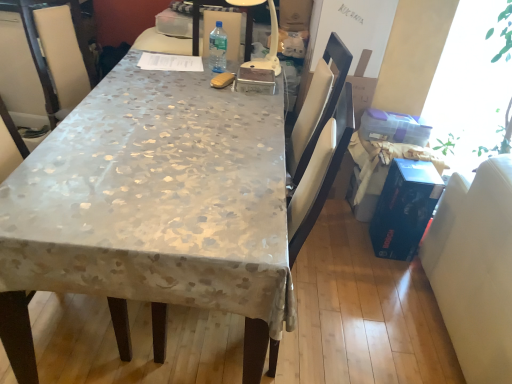
Where is `free space in front of blue cardboard box at right`? The image size is (512, 384). free space in front of blue cardboard box at right is located at coordinates (392, 274).